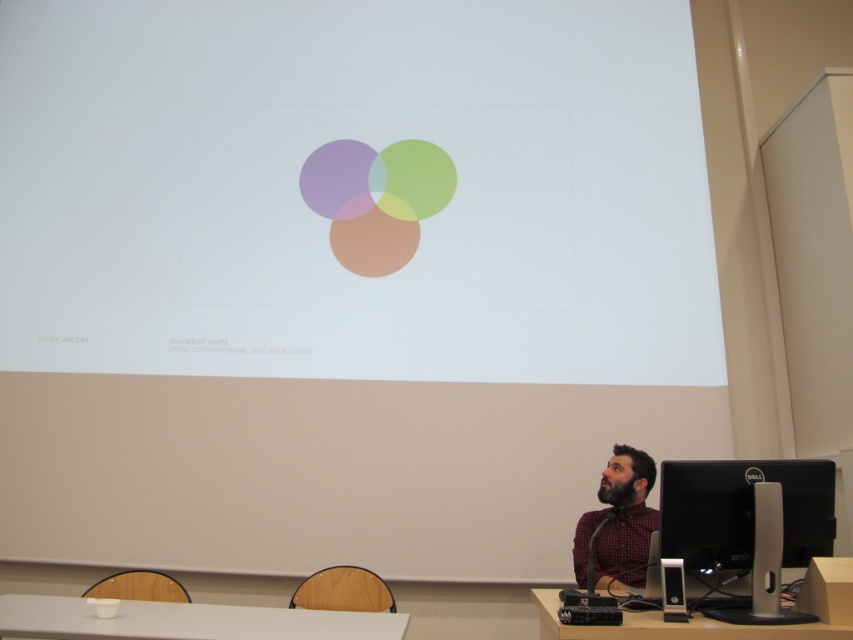
Question: Can you confirm if black glossy monitor at lower right is wider than wooden table at lower right?

Choices:
 (A) yes
 (B) no

Answer: (B)

Question: Observing the image, what is the correct spatial positioning of black glossy monitor at lower right in reference to plaid fabric shirt at lower right?

Choices:
 (A) above
 (B) below

Answer: (A)

Question: From the image, what is the correct spatial relationship of black glossy monitor at lower right in relation to white glossy table at lower center?

Choices:
 (A) right
 (B) left

Answer: (A)

Question: Which of these objects is positioned farthest from the plaid fabric shirt at lower right?

Choices:
 (A) white glossy table at lower center
 (B) black glossy monitor at lower right
 (C) wooden table at lower right

Answer: (A)

Question: Among these objects, which one is farthest from the camera?

Choices:
 (A) white glossy table at lower center
 (B) wooden table at lower right

Answer: (A)

Question: Which point is farther from the camera taking this photo?

Choices:
 (A) (614, 499)
 (B) (787, 560)
 (C) (102, 620)
 (D) (560, 602)

Answer: (A)